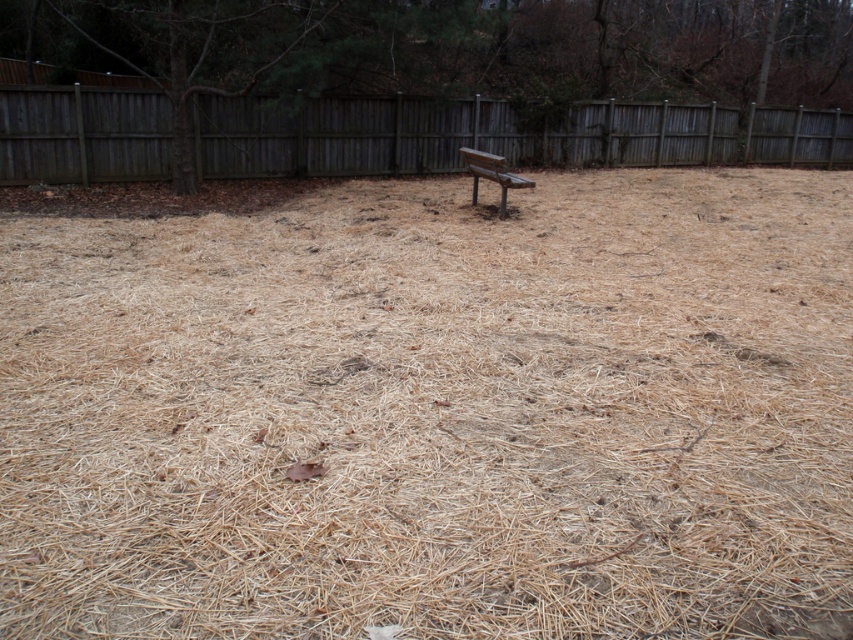
Question: Can you confirm if brown straw at center is positioned below weathered wood fence at upper center?

Choices:
 (A) no
 (B) yes

Answer: (B)

Question: Which point appears closest to the camera in this image?

Choices:
 (A) tap(102, 250)
 (B) tap(502, 209)

Answer: (A)

Question: Can you confirm if weathered wood fence at upper center is thinner than wooden bench at center?

Choices:
 (A) no
 (B) yes

Answer: (A)

Question: Among these objects, which one is nearest to the camera?

Choices:
 (A) wooden bench at center
 (B) brown straw at center
 (C) weathered wood fence at upper center

Answer: (B)

Question: Among these objects, which one is nearest to the camera?

Choices:
 (A) wooden bench at center
 (B) brown straw at center

Answer: (B)

Question: Where is brown straw at center located in relation to wooden bench at center in the image?

Choices:
 (A) above
 (B) below

Answer: (B)